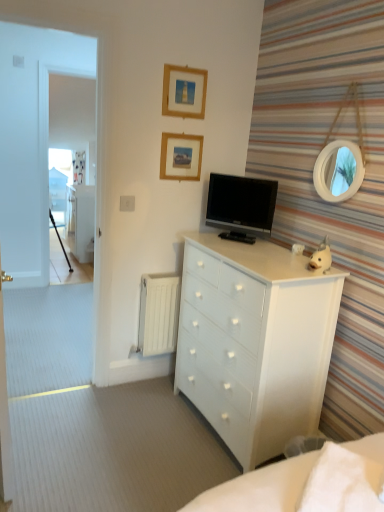
Question: Does point (279, 391) appear closer or farther from the camera than point (155, 284)?

Choices:
 (A) farther
 (B) closer

Answer: (B)

Question: From a real-world perspective, is white glossy chest of drawers at center above or below white matte radiator at lower left?

Choices:
 (A) below
 (B) above

Answer: (B)

Question: Which object is the farthest from the wooden picture frame at upper center, which is counted as the 2th picture frame, starting from the bottom?

Choices:
 (A) black glossy tv at upper center
 (B) white matte radiator at lower left
 (C) white glossy file cabinet at left
 (D) transparent glass door at left
 (E) white glossy chest of drawers at center

Answer: (C)

Question: Which is farther from the black glossy tv at upper center?

Choices:
 (A) white matte radiator at lower left
 (B) white fluffy pillow at lower right
 (C) wooden picture frame at upper center, which is counted as the 2th picture frame, starting from the bottom
 (D) white glossy chest of drawers at center
 (E) wooden picture frame at upper center, which is the first picture frame from bottom to top

Answer: (B)